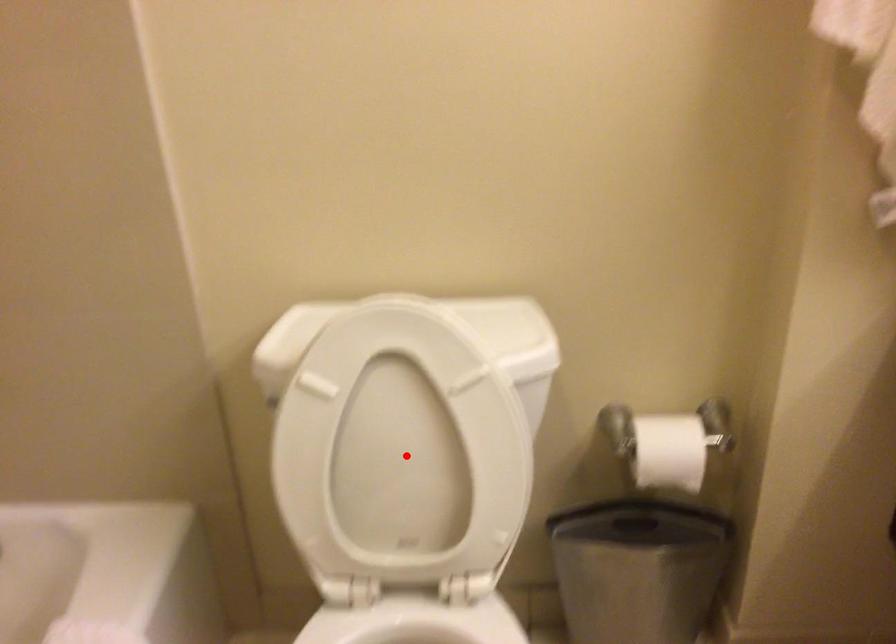
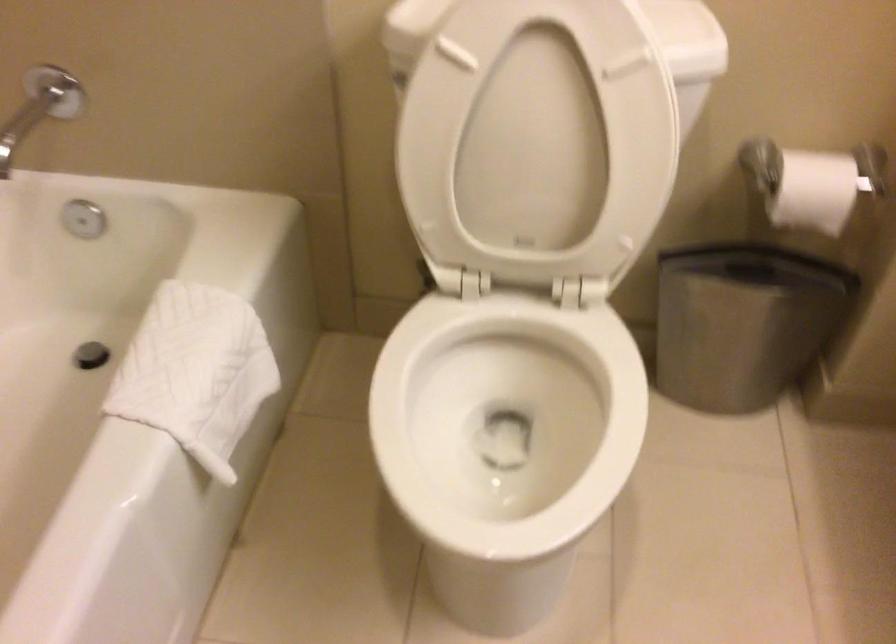
Question: I am providing you with two images of the same scene from different viewpoints. A red point is marked on the first image. Is the red point's position out of view in image 2?

Choices:
 (A) Yes
 (B) No

Answer: (B)